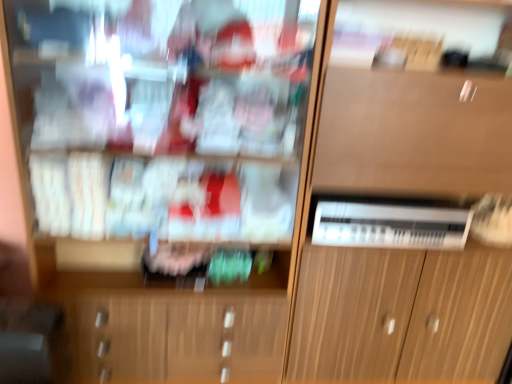
Question: Is wooden cabinet at center further to the viewer compared to white plastic appliance at center?

Choices:
 (A) no
 (B) yes

Answer: (A)

Question: From the image's perspective, does wooden cabinet at center appear lower than white plastic appliance at center?

Choices:
 (A) no
 (B) yes

Answer: (A)

Question: Is wooden cabinet at center far away from white plastic appliance at center?

Choices:
 (A) no
 (B) yes

Answer: (A)

Question: Does wooden cabinet at center have a larger size compared to white plastic appliance at center?

Choices:
 (A) yes
 (B) no

Answer: (A)

Question: Is wooden cabinet at center touching white plastic appliance at center?

Choices:
 (A) yes
 (B) no

Answer: (B)

Question: Considering the relative sizes of wooden cabinet at center and white plastic appliance at center in the image provided, is wooden cabinet at center shorter than white plastic appliance at center?

Choices:
 (A) yes
 (B) no

Answer: (B)

Question: Considering the relative positions of wooden cabinet at center and wooden cabinet at center in the image provided, is wooden cabinet at center to the right of wooden cabinet at center from the viewer's perspective?

Choices:
 (A) no
 (B) yes

Answer: (B)

Question: Considering the relative positions of wooden cabinet at center and wooden cabinet at center in the image provided, is wooden cabinet at center to the left of wooden cabinet at center from the viewer's perspective?

Choices:
 (A) no
 (B) yes

Answer: (A)

Question: Does wooden cabinet at center have a lesser height compared to wooden cabinet at center?

Choices:
 (A) yes
 (B) no

Answer: (B)

Question: Can you see wooden cabinet at center touching wooden cabinet at center?

Choices:
 (A) no
 (B) yes

Answer: (A)

Question: Is wooden cabinet at center smaller than wooden cabinet at center?

Choices:
 (A) no
 (B) yes

Answer: (A)

Question: Can you confirm if wooden cabinet at center is bigger than wooden cabinet at center?

Choices:
 (A) no
 (B) yes

Answer: (B)

Question: Considering the relative sizes of wooden cabinet at center and wooden cabinet at center in the image provided, is wooden cabinet at center bigger than wooden cabinet at center?

Choices:
 (A) yes
 (B) no

Answer: (B)